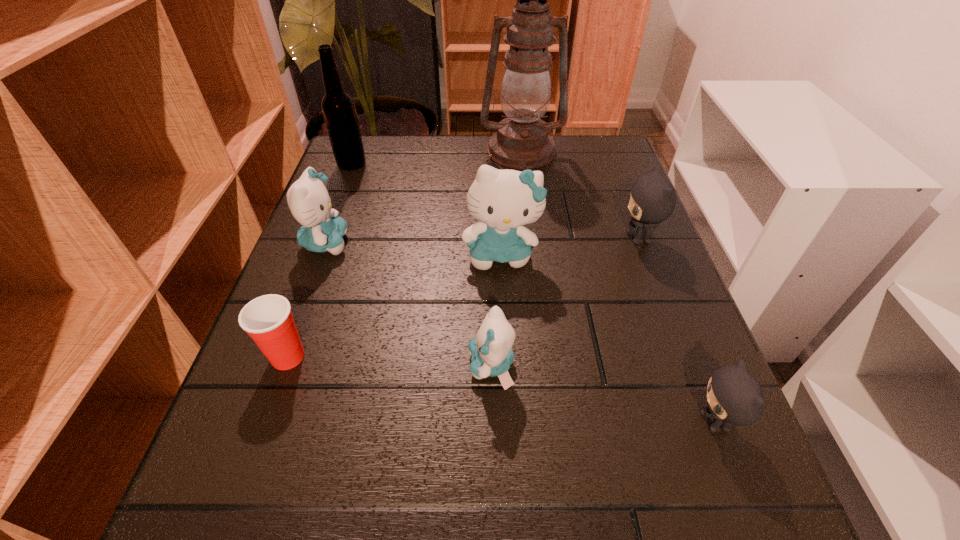
Find the location of a particular element. free spot located 0.140m on the right of the oil lamp is located at coordinates (616, 151).

Where is `free space located on the back of the beer bottle`? Image resolution: width=960 pixels, height=540 pixels. free space located on the back of the beer bottle is located at coordinates (358, 146).

Locate an element on the screen. This screenshot has height=540, width=960. free space located on the face of the third tallest object is located at coordinates (510, 415).

At what (x,y) coordinates should I click in order to perform the action: click on vacant region located 0.200m on the face of the leftmost blue kitten. Please return your answer as a coordinate pair (x, y). Looking at the image, I should click on (448, 243).

In order to click on vacant space located 0.340m on the front-facing side of the farther gray kitten in this screenshot , I will do `click(453, 238)`.

Find the location of a particular element. Image resolution: width=960 pixels, height=540 pixels. vacant space located on the front-facing side of the farther gray kitten is located at coordinates (580, 238).

Find the location of a particular element. free spot located 0.110m on the front-facing side of the farther gray kitten is located at coordinates (565, 238).

This screenshot has width=960, height=540. Find the location of `free region located on the face of the smallest blue kitten`. free region located on the face of the smallest blue kitten is located at coordinates (372, 366).

Locate an element on the screen. This screenshot has height=540, width=960. vacant position located on the face of the smallest blue kitten is located at coordinates (347, 366).

The height and width of the screenshot is (540, 960). Identify the location of free space located on the face of the smallest blue kitten. (264, 366).